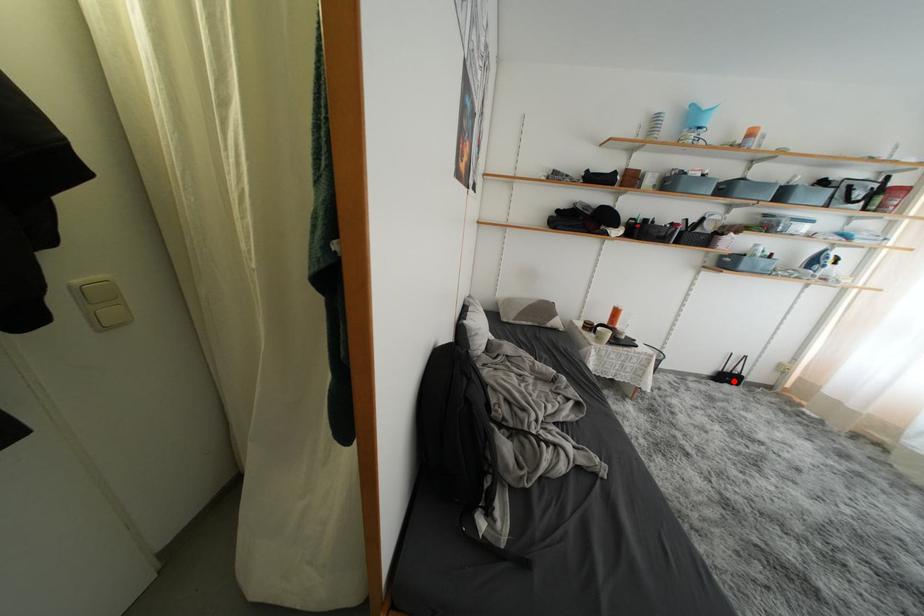
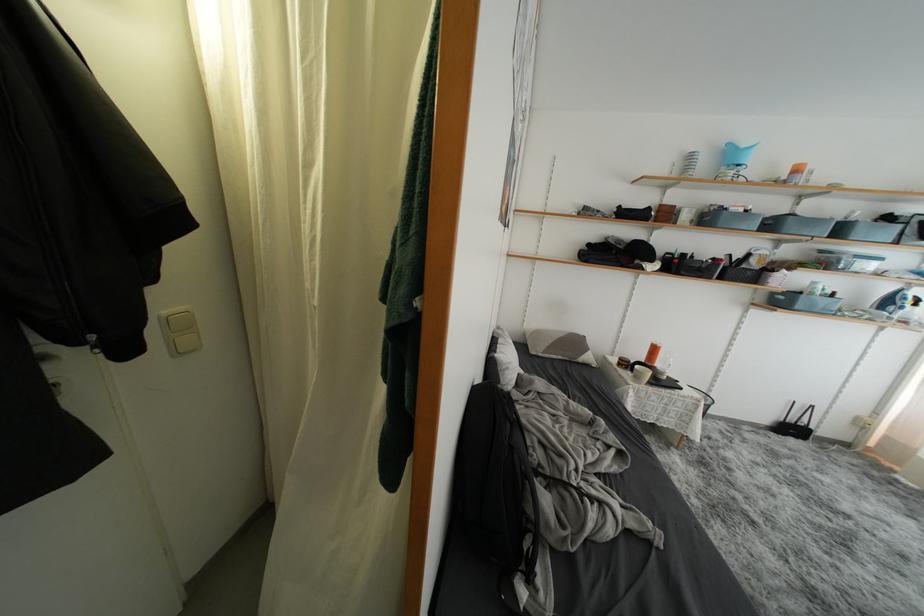
Find the pixel in the second image that matches the highlighted location in the first image.

(797, 434)